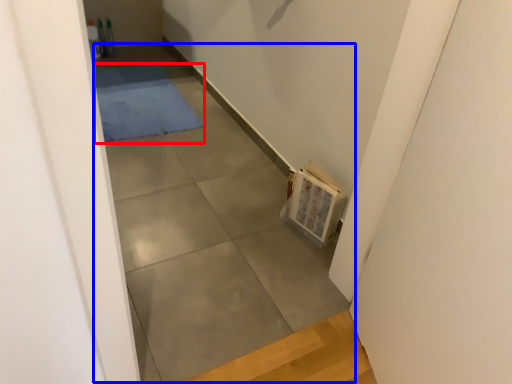
Question: Which point is closer to the camera, mat (highlighted by a red box) or concrete (highlighted by a blue box)?

Choices:
 (A) mat
 (B) concrete

Answer: (B)